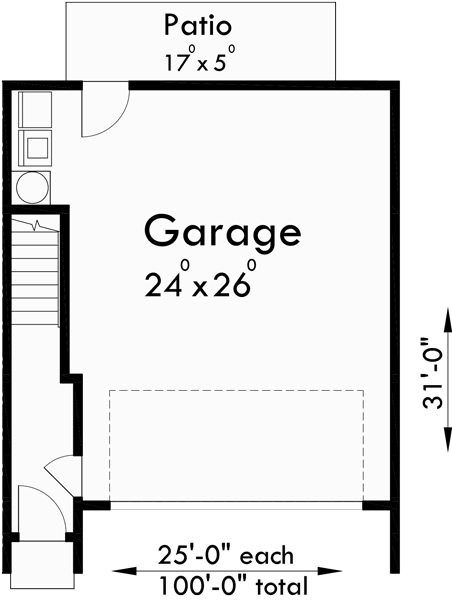
Locate an element on the screen. The image size is (452, 600). stairs is located at coordinates (28, 269).